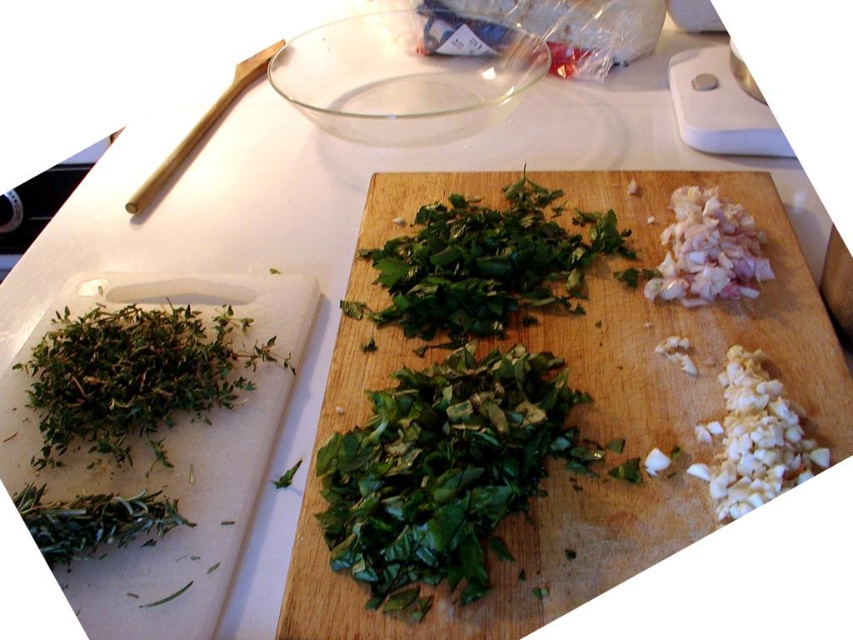
You are a chef preparing a dish and need to know which herb to use. You have a green leafy herb at left and a green leafy at center. Which one is wider?

The green leafy at center is wider than the green leafy herb at left.

You are a chef holding a knife that is 25 centimeters long. You want to cut an ingredient that is located at point (84,323). Can you safely reach that point with your knife without moving your hand?

The distance between point (84,323) and the camera is 55.12 centimeters. Since the knife is only 25 centimeters long, the chef cannot reach the point with the knife without moving their hand.

You are a chef preparing a dish and need to know which leafy green is taller. You see a green leafy herb at left and a green leafy at center. Which one is taller?

The green leafy at center is taller than the green leafy herb at left.